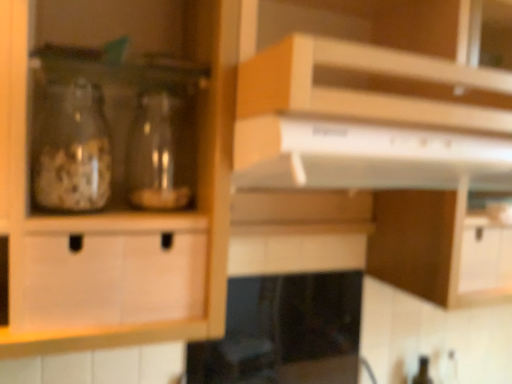
Question: Visually, is transparent glass jar at left, the 2th glass bottle when ordered from right to left, positioned to the left or to the right of black glass stove at lower center?

Choices:
 (A) left
 (B) right

Answer: (A)

Question: From the image's perspective, is transparent glass jar at left, the 2th glass bottle when ordered from right to left, positioned above or below black glass stove at lower center?

Choices:
 (A) above
 (B) below

Answer: (A)

Question: Based on their relative distances, which object is farther from the white glossy exhaust hood at upper center?

Choices:
 (A) transparent glass jar at left, the 2th glass bottle when ordered from right to left
 (B) black glass stove at lower center
 (C) transparent glass jar at center, marked as the second glass bottle in a left-to-right arrangement

Answer: (B)

Question: Which object is positioned closest to the black glass stove at lower center?

Choices:
 (A) transparent glass jar at center, marked as the second glass bottle in a left-to-right arrangement
 (B) transparent glass jar at left, the 2th glass bottle when ordered from right to left
 (C) white glossy exhaust hood at upper center

Answer: (C)